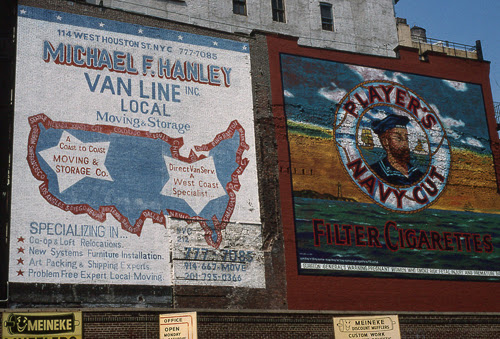
Image resolution: width=500 pixels, height=339 pixels. Find the location of `window`. window is located at coordinates (327, 12), (281, 11), (243, 9), (173, 2).